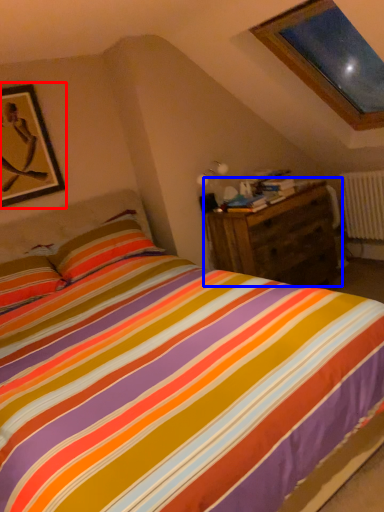
Question: Which of the following is the farthest to the observer, picture frame (highlighted by a red box) or nightstand (highlighted by a blue box)?

Choices:
 (A) picture frame
 (B) nightstand

Answer: (B)